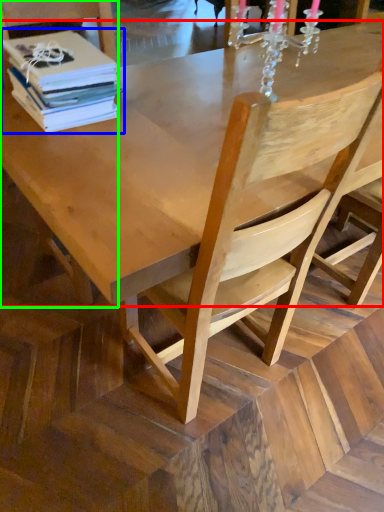
Question: Which object is positioned closest to round table (highlighted by a red box)? Select from book (highlighted by a blue box) and chair (highlighted by a green box).

Choices:
 (A) book
 (B) chair

Answer: (A)